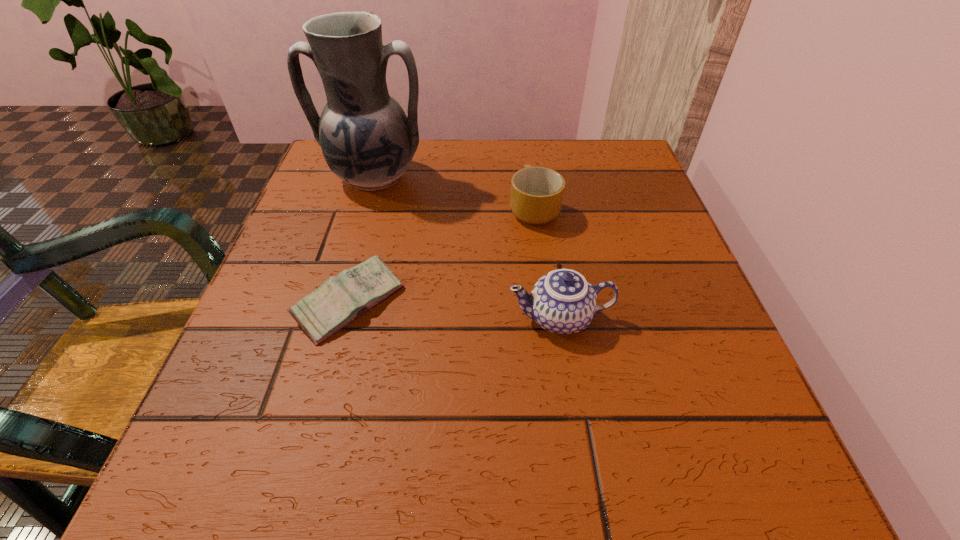
At what (x,y) coordinates should I click in order to perform the action: click on vacant point located between the third shortest object and the mug. Please return your answer as a coordinate pair (x, y). Looking at the image, I should click on (547, 264).

This screenshot has width=960, height=540. Identify the location of blank region between the third shortest object and the second shortest object. (547, 264).

This screenshot has width=960, height=540. I want to click on vacant area between the third shortest object and the mug, so click(x=547, y=264).

At what (x,y) coordinates should I click in order to perform the action: click on vacant space that is in between the diary and the pitcher. Please return your answer as a coordinate pair (x, y). The width and height of the screenshot is (960, 540). Looking at the image, I should click on (362, 241).

Choose which object is the second nearest neighbor to the tallest object. Please provide its 2D coordinates. Your answer should be formatted as a tuple, i.e. [(x, y)], where the tuple contains the x and y coordinates of a point satisfying the conditions above.

[(341, 299)]

Point out which object is positioned as the third nearest to the second shortest object. Please provide its 2D coordinates. Your answer should be formatted as a tuple, i.e. [(x, y)], where the tuple contains the x and y coordinates of a point satisfying the conditions above.

[(341, 299)]

At what (x,y) coordinates should I click in order to perform the action: click on free space that satisfies the following two spatial constraints: 1. on the front-facing side of the shortest object; 2. on the left side of the pitcher. Please return your answer as a coordinate pair (x, y). This screenshot has height=540, width=960. Looking at the image, I should click on (337, 303).

You are a GUI agent. You are given a task and a screenshot of the screen. Output one action in this format:
    pyautogui.click(x=<x>, y=<y>)
    Task: Click on the vacant space that satisfies the following two spatial constraints: 1. on the front-facing side of the pitcher; 2. on the right side of the diary
    
    Given the screenshot: What is the action you would take?
    pyautogui.click(x=337, y=303)

Where is `free location that satisfies the following two spatial constraints: 1. on the front-facing side of the tallest object; 2. on the left side of the shortest object`? This screenshot has width=960, height=540. free location that satisfies the following two spatial constraints: 1. on the front-facing side of the tallest object; 2. on the left side of the shortest object is located at coordinates (337, 303).